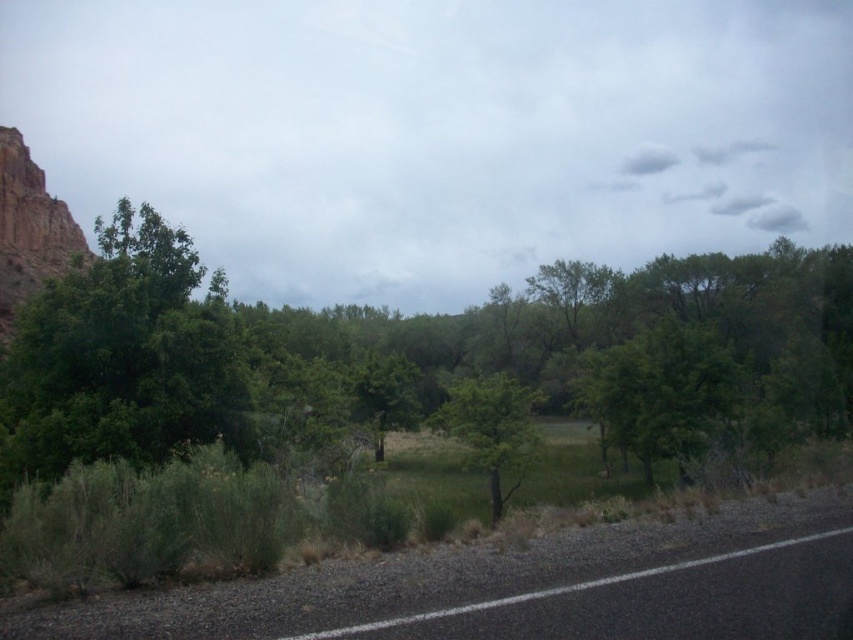
Question: Which is farther from the green leafy tree at left?

Choices:
 (A) black asphalt road at lower right
 (B) rustic brown cliff at left
 (C) green leafy tree at center

Answer: (A)

Question: Can you confirm if rustic brown cliff at left is wider than black asphalt road at lower right?

Choices:
 (A) no
 (B) yes

Answer: (B)

Question: Does green leafy tree at left appear over green leafy tree at center?

Choices:
 (A) yes
 (B) no

Answer: (A)

Question: Is green leafy tree at center behind black asphalt road at lower right?

Choices:
 (A) no
 (B) yes

Answer: (B)

Question: Estimate the real-world distances between objects in this image. Which object is closer to the black asphalt road at lower right?

Choices:
 (A) green leafy tree at center
 (B) green leafy tree at left
 (C) rustic brown cliff at left

Answer: (A)

Question: Which object is farther from the camera taking this photo?

Choices:
 (A) rustic brown cliff at left
 (B) black asphalt road at lower right
 (C) green leafy tree at left
 (D) green leafy tree at center

Answer: (D)